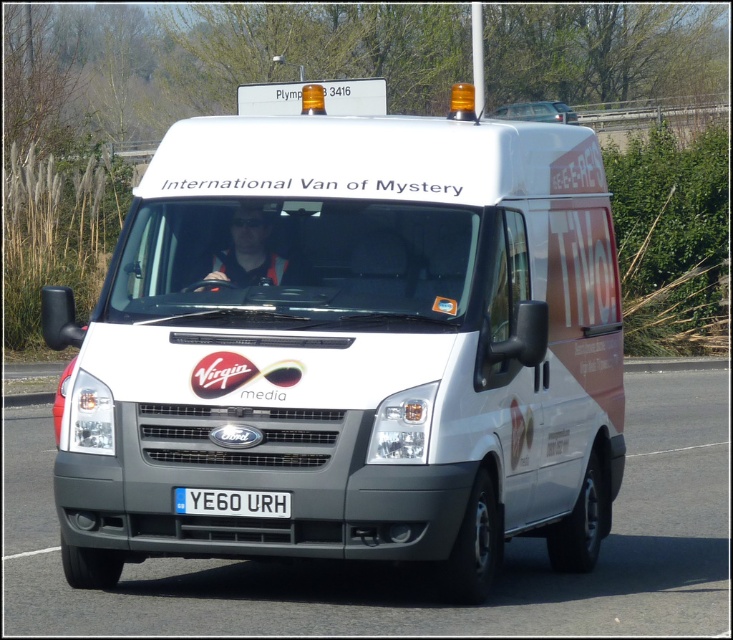
Is white matte van at center smaller than white rectangular license plate at center?

No, white matte van at center is not smaller than white rectangular license plate at center.

Which of these two, white matte van at center or white rectangular license plate at center, stands shorter?

white rectangular license plate at center is shorter.

Between point (452, 157) and point (270, 513), which one is positioned in front?

Point (270, 513)

In order to click on white matte van at center in this screenshot , I will do `click(350, 348)`.